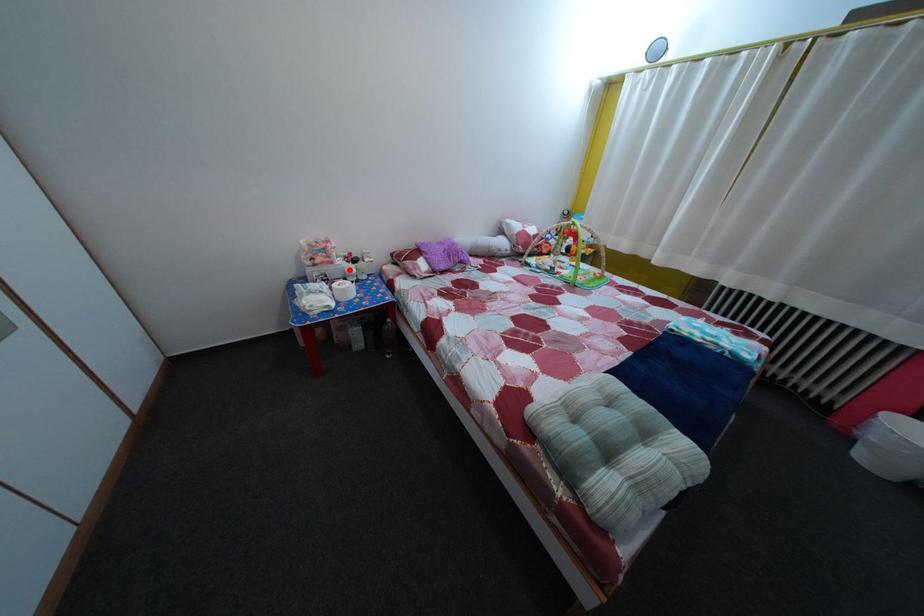
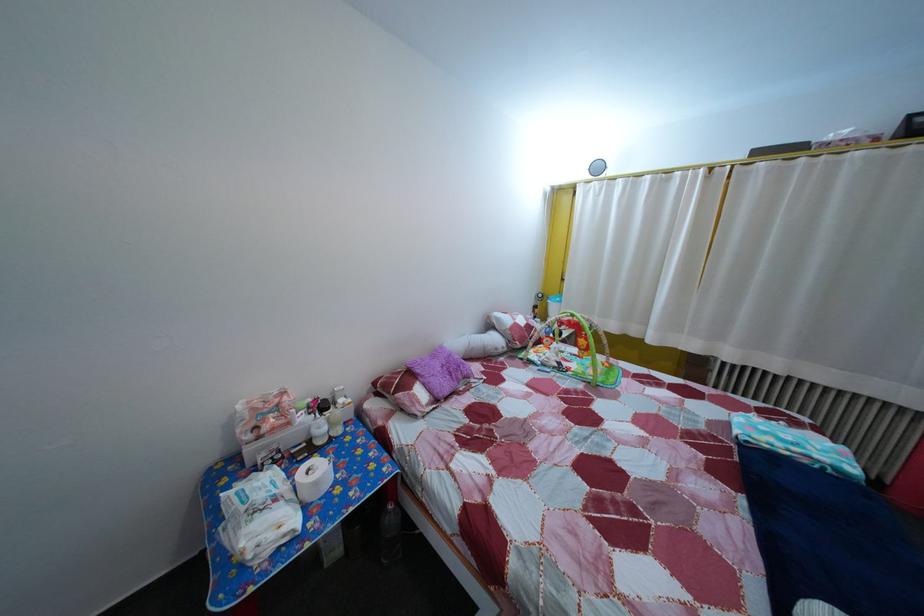
Locate, in the second image, the point that corresponds to the highlighted location in the first image.

(311, 427)